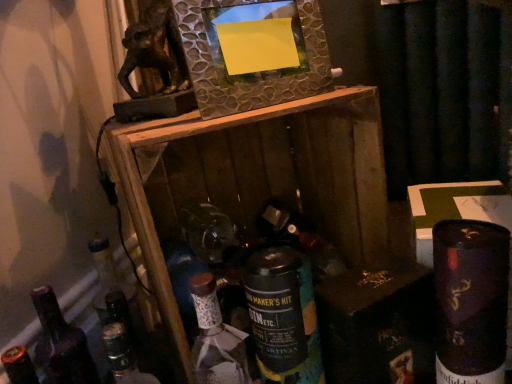
Question: Is metallic textured frame at upper center smaller than shiny dark blue can at lower right, marked as the 4th bottle in a left-to-right arrangement?

Choices:
 (A) no
 (B) yes

Answer: (B)

Question: From a real-world perspective, is metallic textured frame at upper center under shiny dark blue can at lower right, marked as the 4th bottle in a left-to-right arrangement?

Choices:
 (A) yes
 (B) no

Answer: (B)

Question: Is metallic textured frame at upper center bigger than shiny dark blue can at lower right, which is the first bottle in right-to-left order?

Choices:
 (A) yes
 (B) no

Answer: (B)

Question: From the image's perspective, is metallic textured frame at upper center located beneath shiny dark blue can at lower right, marked as the 4th bottle in a left-to-right arrangement?

Choices:
 (A) yes
 (B) no

Answer: (B)

Question: Considering the relative positions of metallic textured frame at upper center and shiny dark blue can at lower right, marked as the 4th bottle in a left-to-right arrangement, in the image provided, is metallic textured frame at upper center behind shiny dark blue can at lower right, marked as the 4th bottle in a left-to-right arrangement,?

Choices:
 (A) no
 (B) yes

Answer: (B)

Question: From the image's perspective, relative to shiny dark blue can at lower right, marked as the 4th bottle in a left-to-right arrangement, is metallic textured frame at upper center above or below?

Choices:
 (A) above
 (B) below

Answer: (A)

Question: Based on their sizes in the image, would you say metallic textured frame at upper center is bigger or smaller than shiny dark blue can at lower right, marked as the 4th bottle in a left-to-right arrangement?

Choices:
 (A) small
 (B) big

Answer: (A)

Question: Does point (203, 77) appear closer or farther from the camera than point (454, 319)?

Choices:
 (A) closer
 (B) farther

Answer: (B)

Question: In terms of height, does metallic textured frame at upper center look taller or shorter compared to shiny dark blue can at lower right, which is the first bottle in right-to-left order?

Choices:
 (A) short
 (B) tall

Answer: (A)

Question: Does point (302, 223) appear closer or farther from the camera than point (266, 92)?

Choices:
 (A) closer
 (B) farther

Answer: (B)

Question: Considering their positions, is matte glass wine bottle at center located in front of or behind metallic textured frame at upper center?

Choices:
 (A) behind
 (B) front

Answer: (A)

Question: Considering the positions of matte glass wine bottle at center and metallic textured frame at upper center in the image, is matte glass wine bottle at center bigger or smaller than metallic textured frame at upper center?

Choices:
 (A) big
 (B) small

Answer: (B)

Question: From the image's perspective, is matte glass wine bottle at center positioned above or below metallic textured frame at upper center?

Choices:
 (A) above
 (B) below

Answer: (B)

Question: From a real-world perspective, is shiny dark blue can at lower right, marked as the 4th bottle in a left-to-right arrangement, positioned above or below matte glass wine bottle at center?

Choices:
 (A) above
 (B) below

Answer: (B)

Question: Is shiny dark blue can at lower right, which is the first bottle in right-to-left order, bigger or smaller than matte glass wine bottle at center?

Choices:
 (A) big
 (B) small

Answer: (A)